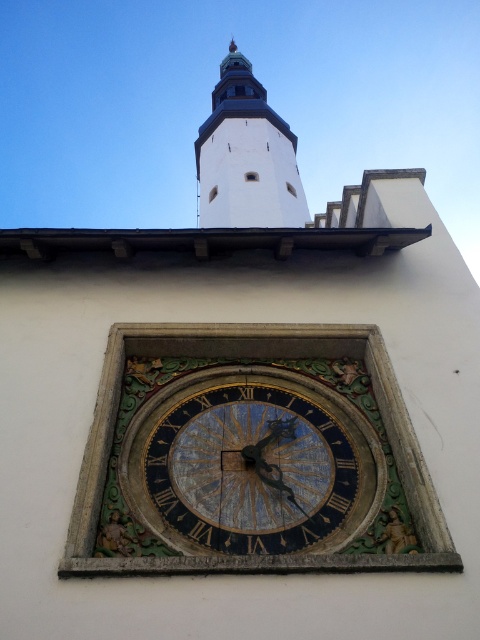
Based on the photo, you are standing in front of the building and want to take a photo that includes both the gold textured clock at center and the white stone bell tower at upper center. Which object should you focus on first to ensure both are in the frame?

You should focus on the gold textured clock at center first because it is shorter than the white stone bell tower at upper center, so positioning the camera to include the taller bell tower will naturally include the shorter clock in the frame.

In the scene shown: You are an architect examining the building facade. You notice the gold textured clock at center and the white stone bell tower at upper center. Which object is located to the right of the other?

The gold textured clock at center is positioned on the right side of white stone bell tower at upper center.

You are standing in front of a building and notice two structures. One is the gold textured clock at center and the other is the white stone bell tower at upper center. Which of these two structures appears larger in size?

The gold textured clock at center is smaller than the white stone bell tower at upper center, so the white stone bell tower at upper center appears larger in size.